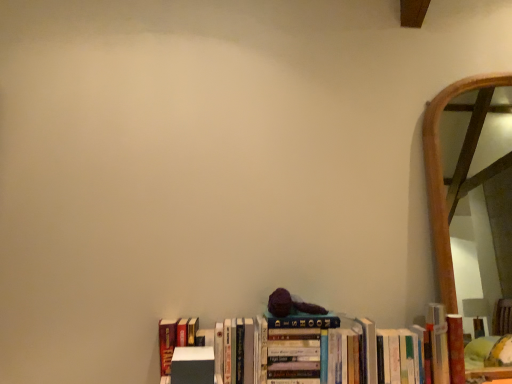
The image size is (512, 384). In order to click on matte green book at lower left in this screenshot , I will do `click(176, 342)`.

The width and height of the screenshot is (512, 384). Describe the element at coordinates (176, 342) in the screenshot. I see `matte green book at lower left` at that location.

What is the approximate height of matte green book at lower left?

7.13 inches.

Image resolution: width=512 pixels, height=384 pixels. In order to click on matte green book at lower left in this screenshot , I will do `click(176, 342)`.